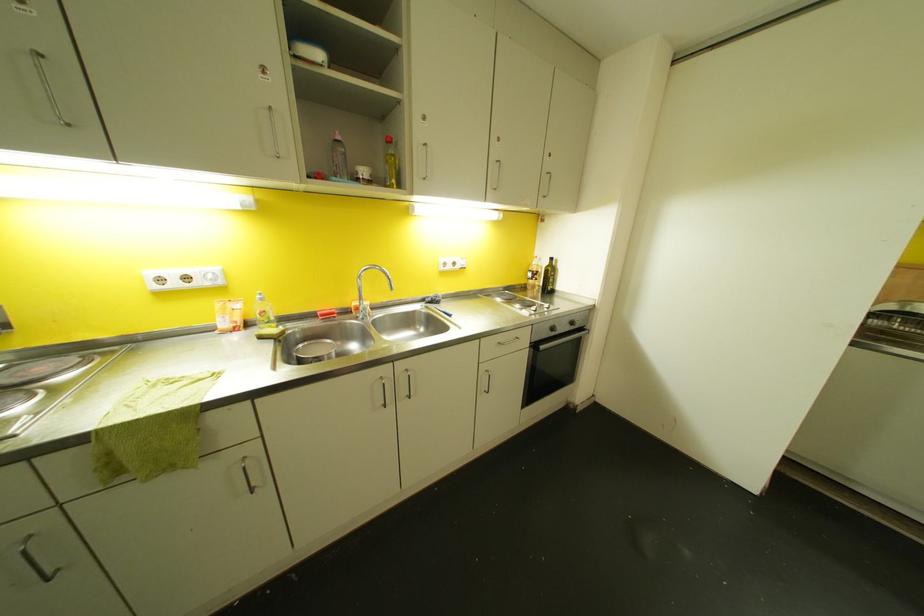
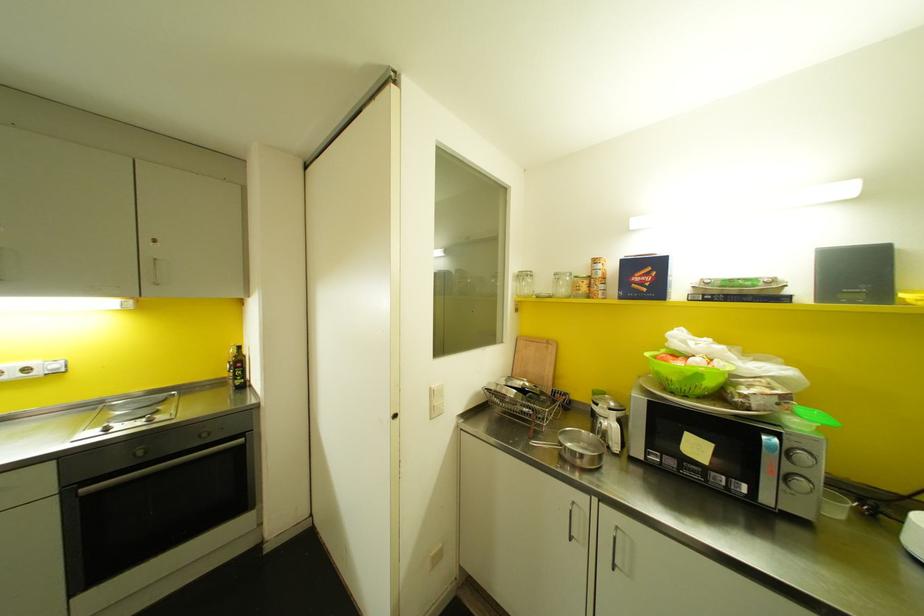
Question: In a continuous first-person perspective shot, in which direction is the camera moving?

Choices:
 (A) Left
 (B) Right
 (C) Forward
 (D) Backward

Answer: (B)